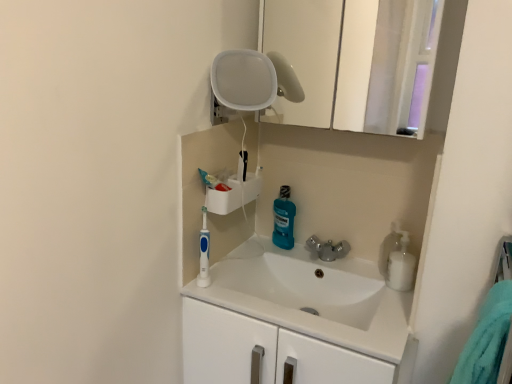
Question: Is blue glossy mouthwash at center, which is the 2th cleaning product in front-to-back order, taller than white glossy medicine cabinet at upper center?

Choices:
 (A) no
 (B) yes

Answer: (A)

Question: From a real-world perspective, is blue glossy mouthwash at center, which is the 2th cleaning product in front-to-back order, below white glossy medicine cabinet at upper center?

Choices:
 (A) no
 (B) yes

Answer: (B)

Question: From the image's perspective, is blue glossy mouthwash at center, which is the 2th cleaning product in front-to-back order, located above white glossy medicine cabinet at upper center?

Choices:
 (A) yes
 (B) no

Answer: (B)

Question: Does blue glossy mouthwash at center, which is the 2th cleaning product in front-to-back order, have a smaller size compared to white glossy medicine cabinet at upper center?

Choices:
 (A) yes
 (B) no

Answer: (A)

Question: Does blue glossy mouthwash at center, positioned as the second cleaning product in right-to-left order, appear on the right side of white glossy medicine cabinet at upper center?

Choices:
 (A) no
 (B) yes

Answer: (A)

Question: Considering the relative sizes of blue glossy mouthwash at center, positioned as the second cleaning product in right-to-left order, and white glossy medicine cabinet at upper center in the image provided, is blue glossy mouthwash at center, positioned as the second cleaning product in right-to-left order, bigger than white glossy medicine cabinet at upper center?

Choices:
 (A) no
 (B) yes

Answer: (A)

Question: Can you confirm if blue glossy mouthwash at center, acting as the 1th cleaning product starting from the back, is taller than white glossy sink at center?

Choices:
 (A) yes
 (B) no

Answer: (B)

Question: Does blue glossy mouthwash at center, positioned as the second cleaning product in right-to-left order, appear on the right side of white glossy sink at center?

Choices:
 (A) no
 (B) yes

Answer: (A)

Question: Considering the relative positions of blue glossy mouthwash at center, marked as the 1th cleaning product in a left-to-right arrangement, and white glossy sink at center in the image provided, is blue glossy mouthwash at center, marked as the 1th cleaning product in a left-to-right arrangement, to the left of white glossy sink at center from the viewer's perspective?

Choices:
 (A) yes
 (B) no

Answer: (A)

Question: From the image's perspective, is blue glossy mouthwash at center, marked as the 1th cleaning product in a left-to-right arrangement, on top of white glossy sink at center?

Choices:
 (A) yes
 (B) no

Answer: (A)

Question: Is blue glossy mouthwash at center, positioned as the second cleaning product in right-to-left order, turned away from white glossy sink at center?

Choices:
 (A) no
 (B) yes

Answer: (A)

Question: Is blue glossy mouthwash at center, acting as the 1th cleaning product starting from the back, wider than white glossy sink at center?

Choices:
 (A) no
 (B) yes

Answer: (A)

Question: Is white glossy sink at center positioned before blue plastic toothbrush at center-left?

Choices:
 (A) no
 (B) yes

Answer: (B)